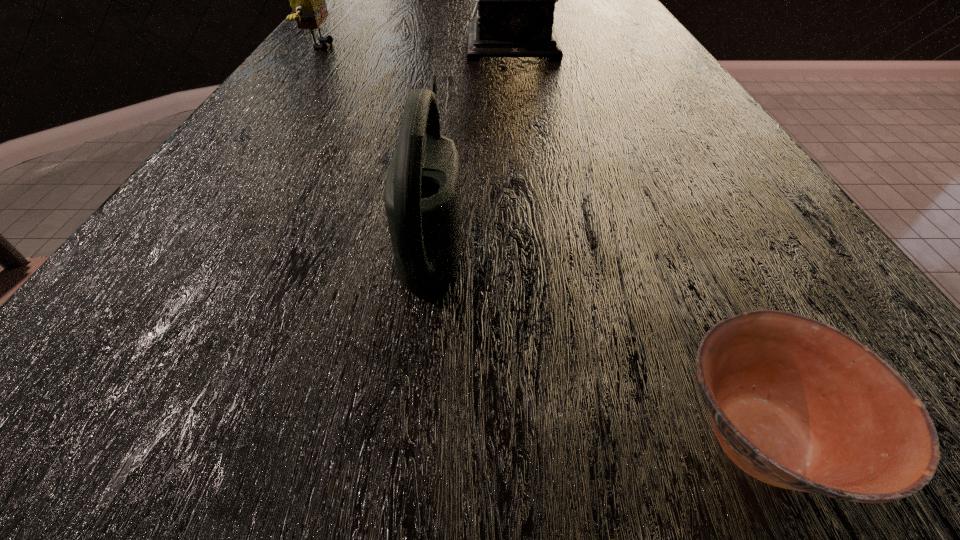
At what (x,y) coordinates should I click in order to perform the action: click on object at the left edge. Please return your answer as a coordinate pair (x, y). This screenshot has height=540, width=960. Looking at the image, I should click on (307, 0).

Where is `object at the right edge`? The image size is (960, 540). object at the right edge is located at coordinates (796, 403).

Find the location of a particular element. The image size is (960, 540). object present at the near right corner is located at coordinates (796, 403).

The image size is (960, 540). Find the location of `free space at the far edge of the desktop`. free space at the far edge of the desktop is located at coordinates (558, 15).

Identify the location of free space at the left edge of the desktop. (334, 36).

Where is `free region at the right edge`? free region at the right edge is located at coordinates (731, 203).

Identify the location of vacant region at the far left corner of the desktop. The width and height of the screenshot is (960, 540). (360, 3).

Locate an element on the screen. The image size is (960, 540). empty location between the tallest object and the nearest object is located at coordinates (642, 241).

In order to click on empty space that is in between the second nearest object and the shortest object in this screenshot , I will do (597, 335).

What are the coordinates of `blank region between the record player and the shortest object` in the screenshot? It's located at (642, 241).